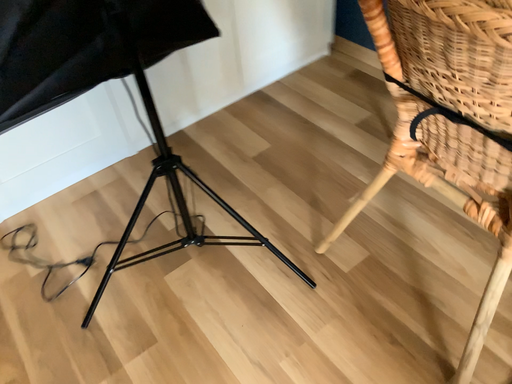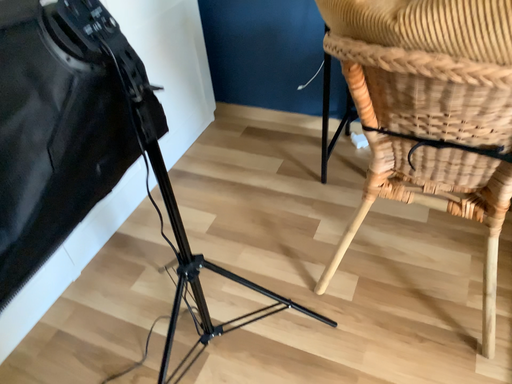
Question: Which way did the camera rotate in the video?

Choices:
 (A) rotated downward
 (B) rotated upward

Answer: (B)